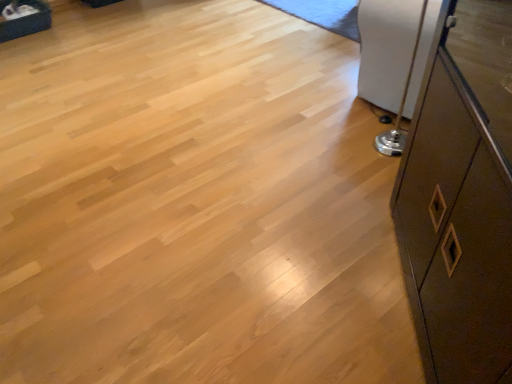
Describe the element at coordinates (462, 200) in the screenshot. I see `matte brown cabinet at right` at that location.

Find the location of a particular element. This screenshot has height=384, width=512. matte brown cabinet at right is located at coordinates (462, 200).

This screenshot has width=512, height=384. What are the coordinates of `matte brown cabinet at right` in the screenshot? It's located at (462, 200).